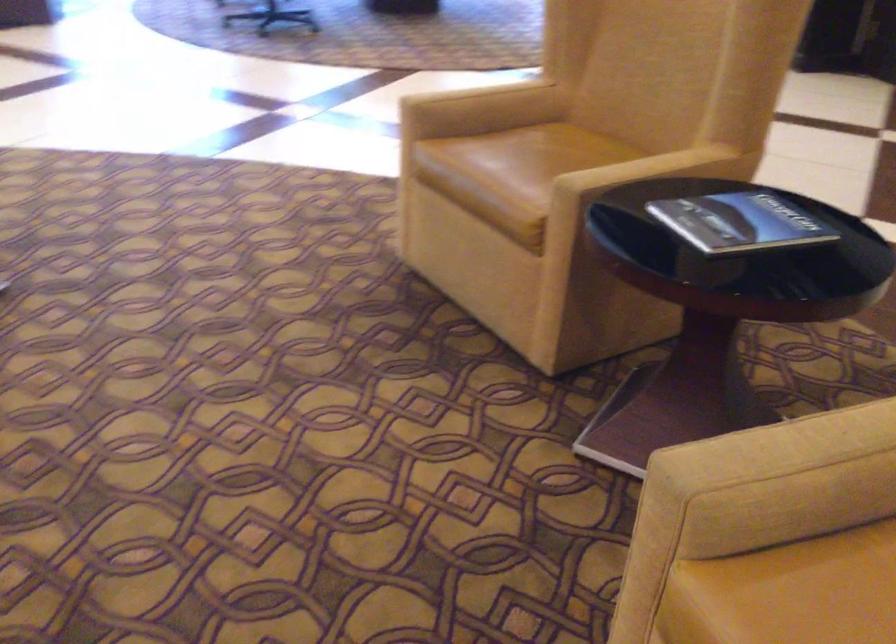
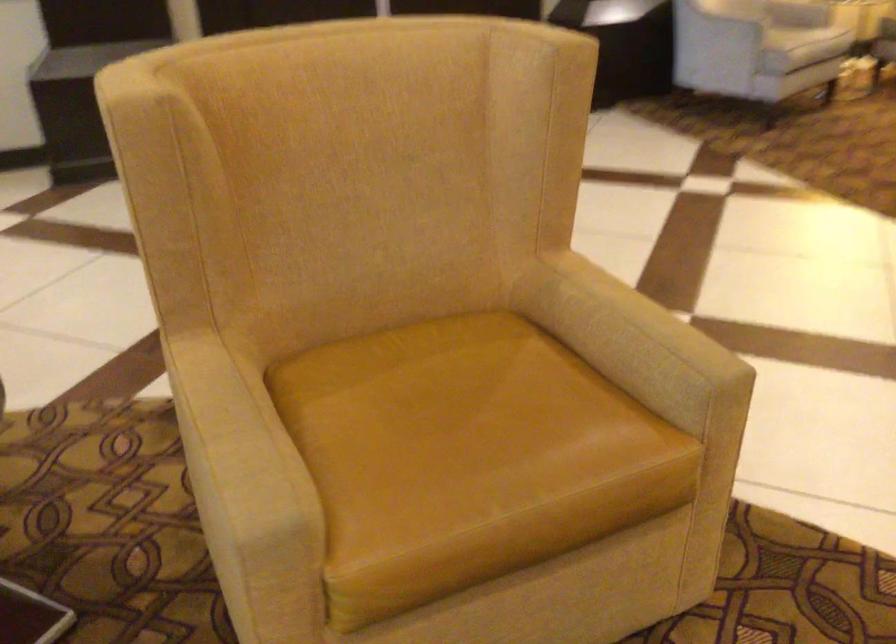
The point at [799,429] is marked in the first image. Where is the corresponding point in the second image?

(235, 435)